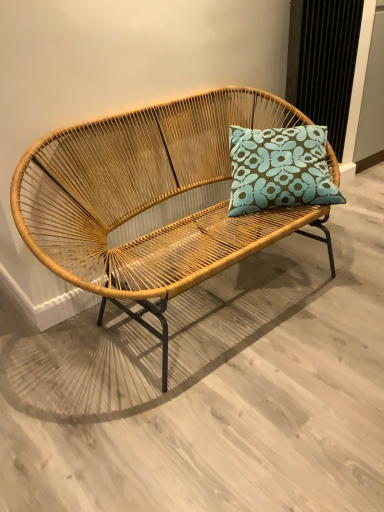
I want to click on vacant space in front of natural woven studio couch at center, so click(232, 418).